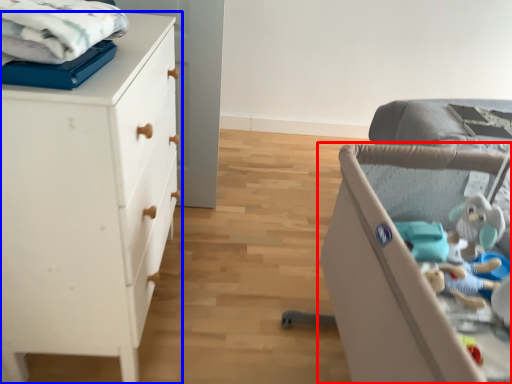
Question: Which point is further to the camera, infant bed (highlighted by a red box) or chest of drawers (highlighted by a blue box)?

Choices:
 (A) infant bed
 (B) chest of drawers

Answer: (B)